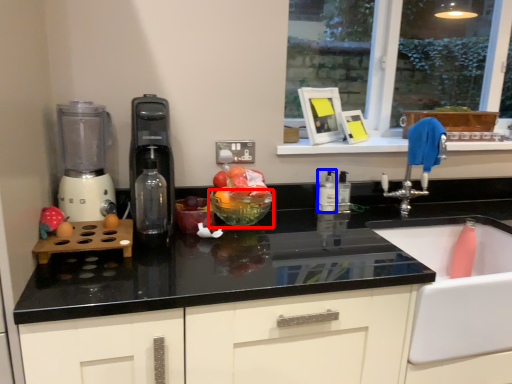
Question: Which object is further to the camera taking this photo, glass bowl (highlighted by a red box) or bottle (highlighted by a blue box)?

Choices:
 (A) glass bowl
 (B) bottle

Answer: (B)